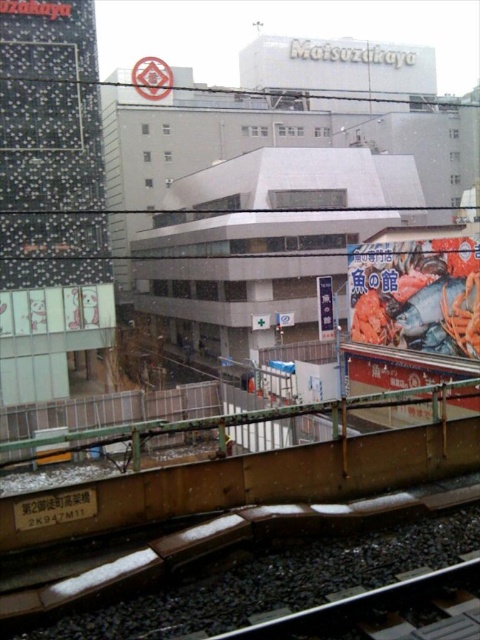
You are a commuter looking out the train window and see the bright orange seafood at right and the white paper sign at center. Which object is nearer to you?

The bright orange seafood at right is closer to the viewer than the white paper sign at center.

You are a commuter looking out the train window and see the bright orange seafood at right and the white paper sign at center. Which object is wider?

The bright orange seafood at right might be wider than the white paper sign at center according to the description.

You are a commuter on the train looking out the window. You notice the bright orange seafood at right and the white paper sign at center. Which object is closer to you?

The bright orange seafood at right is positioned under the white paper sign at center, so the white paper sign at center is closer to you.